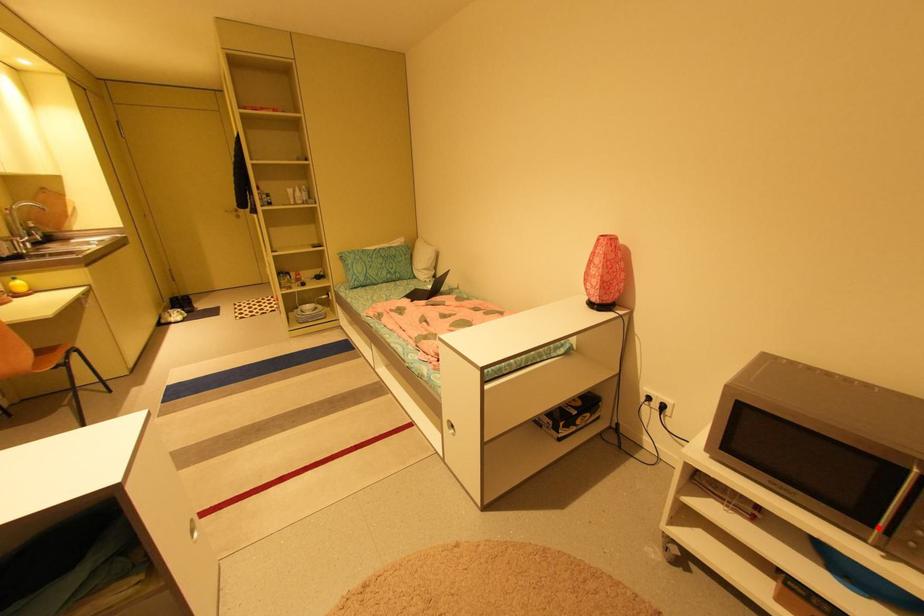
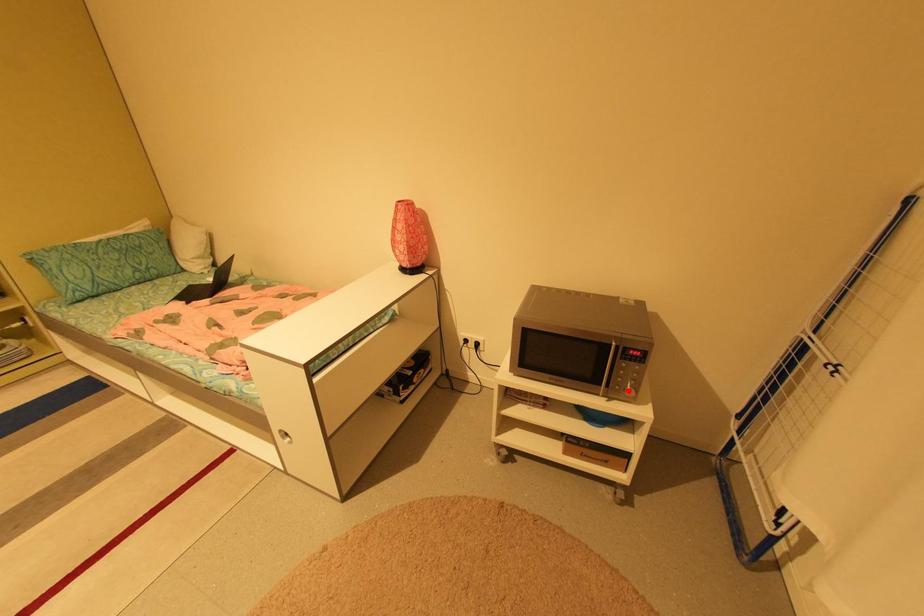
I am providing you with two images of the same scene from different viewpoints. A red point is marked on the first image and another point is marked on the second image. Are the points marked in image1 and image2 representing the same 3D position?

No